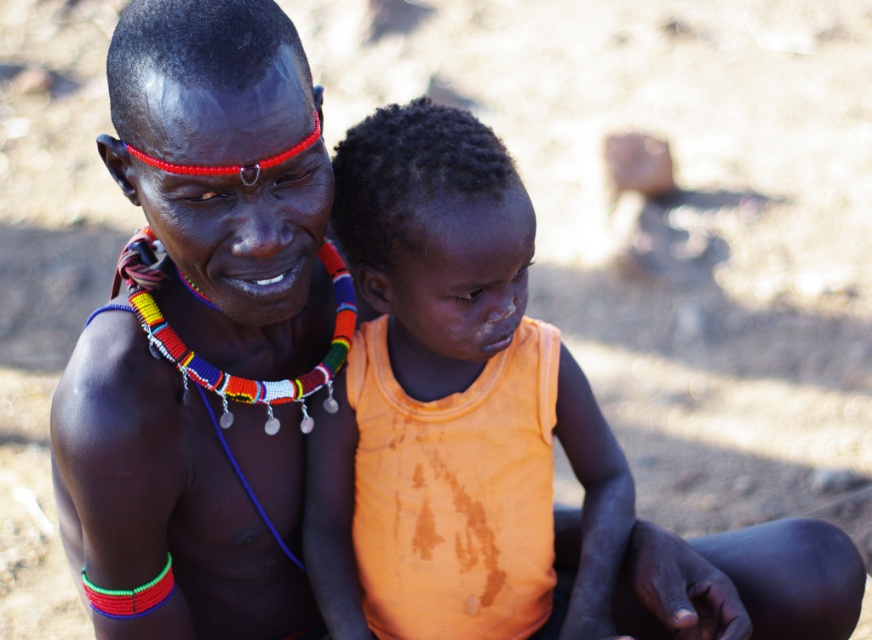
Does matte black face paint at center have a smaller size compared to orange fabric shirt at center?

A: No.

Between matte black face paint at center and orange fabric shirt at center, which one is positioned lower?

orange fabric shirt at center is lower down.

You are a GUI agent. You are given a task and a screenshot of the screen. Output one action in this format:
    pyautogui.click(x=<x>, y=<y>)
    Task: Click on the matte black face paint at center
    The width and height of the screenshot is (872, 640).
    Given the screenshot: What is the action you would take?
    pyautogui.click(x=203, y=332)